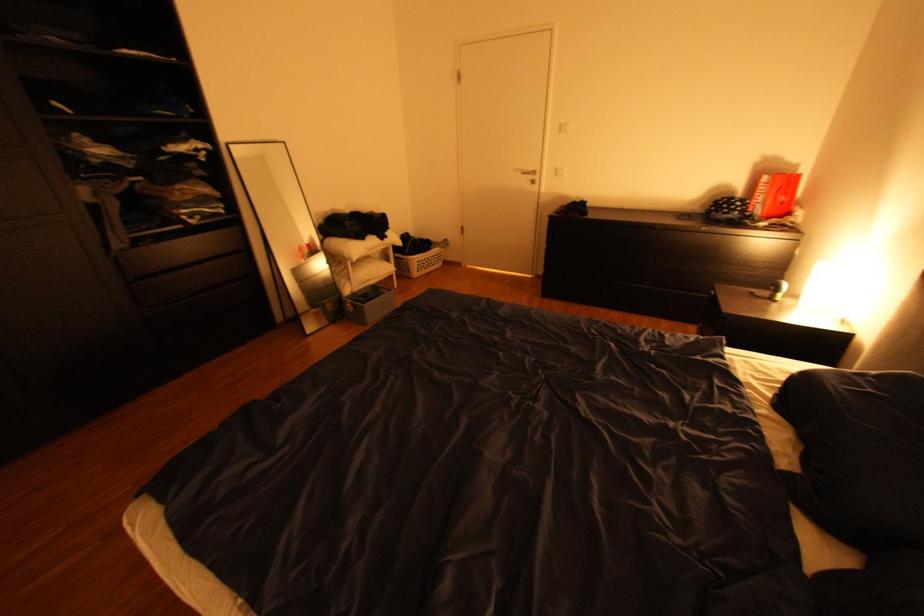
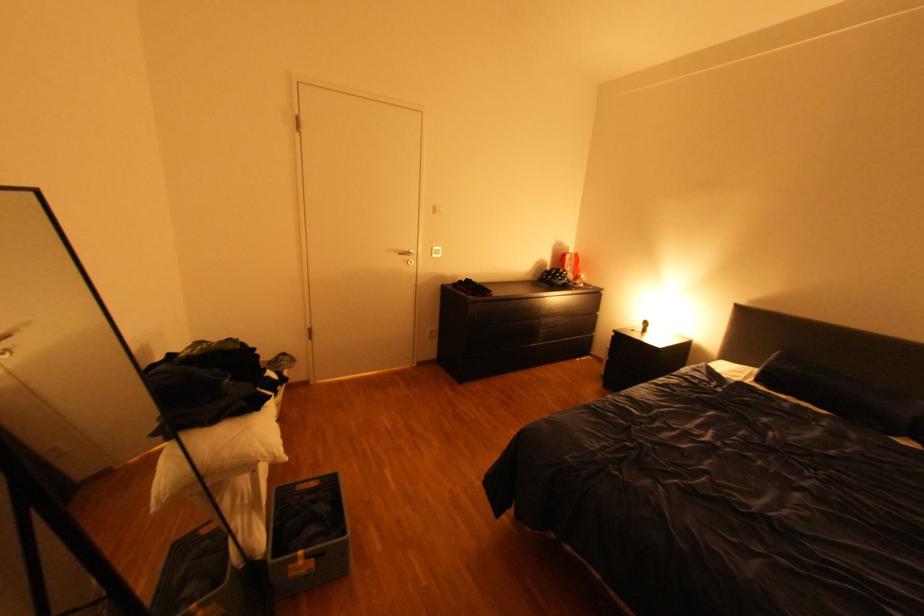
Locate, in the second image, the point that corresponds to point (391, 290) in the first image.

(310, 488)